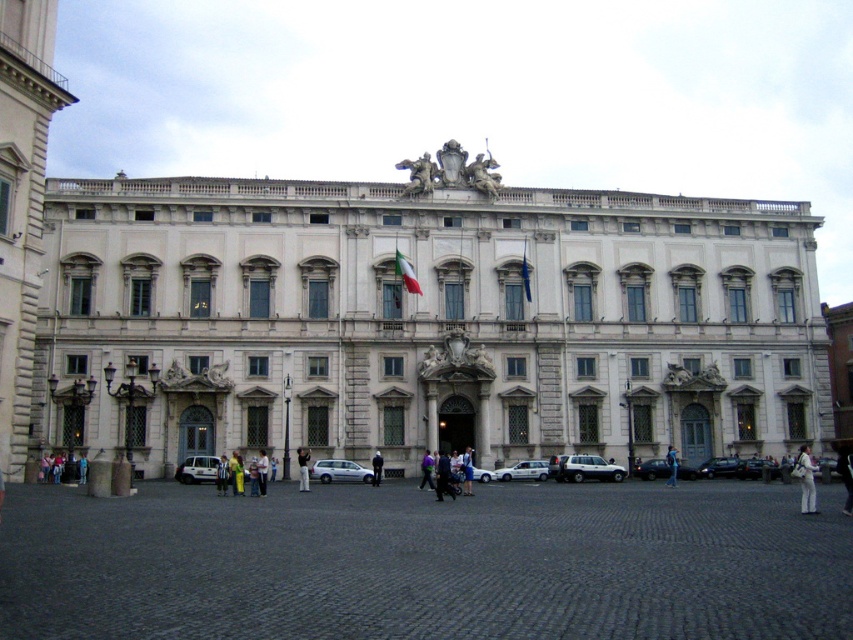
Question: Which of the following is the farthest from the observer?

Choices:
 (A) red fabric flag at center
 (B) white fabric bag at center
 (C) metallic silver car at center

Answer: (C)

Question: Which object is the farthest from the dark blue uniform at center?

Choices:
 (A) white matte van at lower left
 (B) blue denim jeans at center

Answer: (B)

Question: Observing the image, what is the correct spatial positioning of white stone building at center in reference to white matte van at lower left?

Choices:
 (A) right
 (B) left

Answer: (A)

Question: Which object is closer to the camera taking this photo?

Choices:
 (A) matte white flag at center
 (B) blue denim jeans at center
 (C) yellow fabric bag at center

Answer: (C)

Question: Where is light blue denim pants at center located in relation to matte white flag at center in the image?

Choices:
 (A) above
 (B) below

Answer: (B)

Question: Can you confirm if blue denim jeans at center is bigger than matte white flag at center?

Choices:
 (A) yes
 (B) no

Answer: (A)